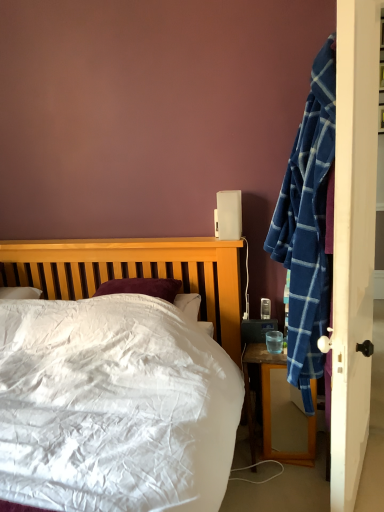
Question: From a real-world perspective, is clear glass cup at nightstand right physically located above or below white plastic speaker at upper right?

Choices:
 (A) above
 (B) below

Answer: (B)

Question: From the image's perspective, is clear glass cup at nightstand right located above or below white plastic speaker at upper right?

Choices:
 (A) below
 (B) above

Answer: (A)

Question: Which is farther from the white plastic speaker at upper right?

Choices:
 (A) wooden desk at right
 (B) clear glass cup at nightstand right

Answer: (A)

Question: Considering the real-world distances, which object is closest to the white plastic speaker at upper right?

Choices:
 (A) clear glass cup at nightstand right
 (B) wooden desk at right

Answer: (A)